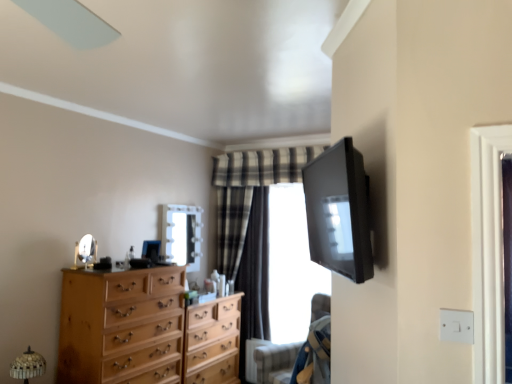
Question: Is denim fabric armchair at lower right to the left or to the right of silver/metallic mirror at center-left, the second mirror when ordered from right to left, in the image?

Choices:
 (A) right
 (B) left

Answer: (A)

Question: From the image's perspective, relative to silver/metallic mirror at center-left, which appears as the 1th mirror when viewed from the left, is denim fabric armchair at lower right above or below?

Choices:
 (A) below
 (B) above

Answer: (A)

Question: Which object is the closest to the wooden dresser at left, which is the 1th chest of drawers in front-to-back order?

Choices:
 (A) denim fabric armchair at lower right
 (B) matte glass mirror at center, the 2th mirror positioned from the front
 (C) clear glass window at center
 (D) light wood chest of drawers at center, positioned as the first chest of drawers in back-to-front order
 (E) silver/metallic mirror at center-left, the second mirror when ordered from right to left

Answer: (D)

Question: Considering the real-world distances, which object is closest to the plaid fabric curtain at center?

Choices:
 (A) silver/metallic mirror at center-left, positioned as the 1th mirror in front-to-back order
 (B) matte glass mirror at center, which is counted as the first mirror, starting from the back
 (C) wooden dresser at left, which is the 1th chest of drawers in front-to-back order
 (D) light wood chest of drawers at center, the second chest of drawers in the front-to-back sequence
 (E) denim fabric armchair at lower right

Answer: (D)